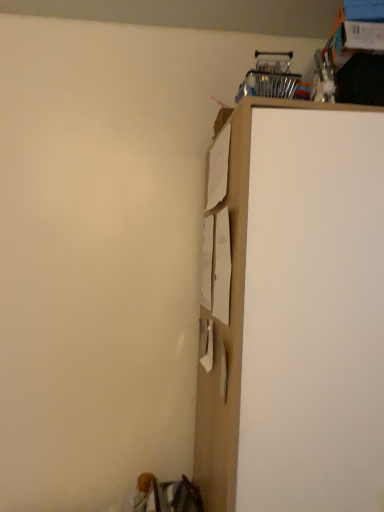
Question: Should I look upward or downward to see wooden cabinet at upper right?

Choices:
 (A) down
 (B) up

Answer: (A)